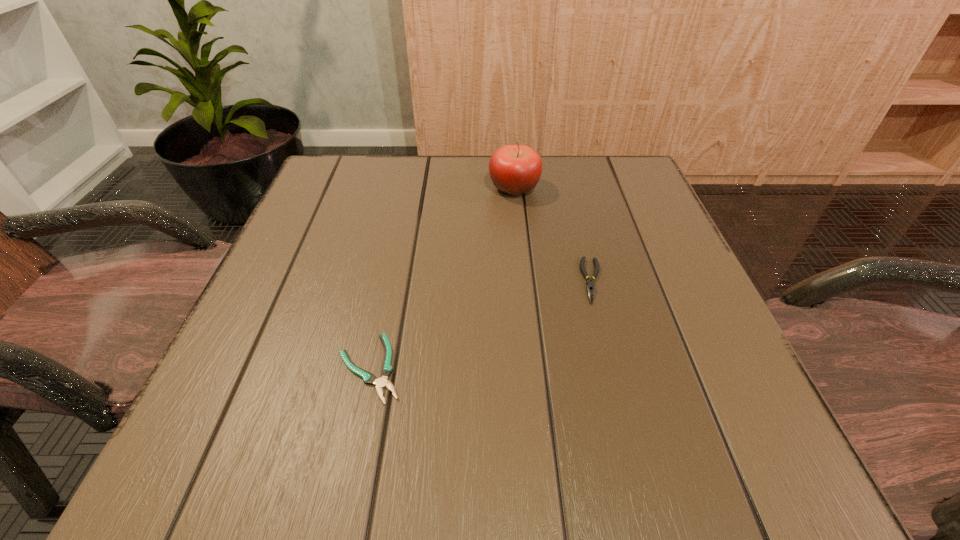
Where is `the tallest object`? The width and height of the screenshot is (960, 540). the tallest object is located at coordinates (514, 169).

What are the coordinates of `the farthest object` in the screenshot? It's located at (514, 169).

What are the coordinates of `the second nearest object` in the screenshot? It's located at (590, 285).

Locate an element on the screen. The width and height of the screenshot is (960, 540). the second tallest object is located at coordinates (590, 285).

This screenshot has height=540, width=960. What are the coordinates of `the nearest object` in the screenshot? It's located at (386, 370).

The width and height of the screenshot is (960, 540). I want to click on the left pliers, so click(386, 370).

Identify the location of free region located 0.110m on the left of the tallest object. (440, 188).

Identify the location of vacant region located 0.370m on the left of the right pliers. (374, 281).

Image resolution: width=960 pixels, height=540 pixels. I want to click on vacant area situated on the back of the left pliers, so click(385, 294).

Find the location of `object located in the far edge section of the desktop`. object located in the far edge section of the desktop is located at coordinates (514, 169).